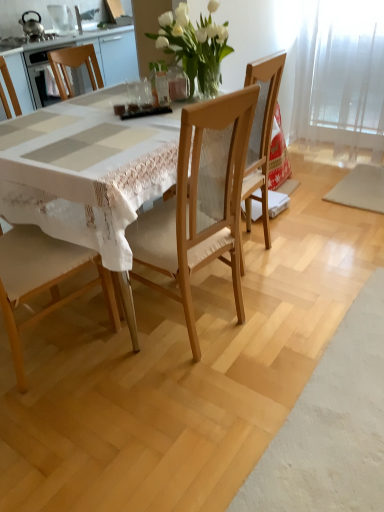
Image resolution: width=384 pixels, height=512 pixels. In order to click on free space in front of white fabric chair at left, the 1th chair when ordered from left to right in this screenshot , I will do [57, 420].